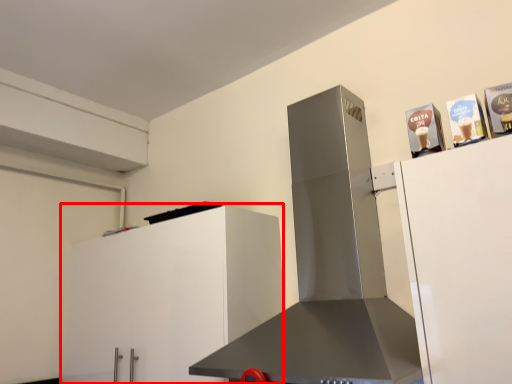
Question: Considering the relative positions of cabinetry (annotated by the red box) and home appliance in the image provided, where is cabinetry (annotated by the red box) located with respect to the staircase?

Choices:
 (A) left
 (B) right

Answer: (A)